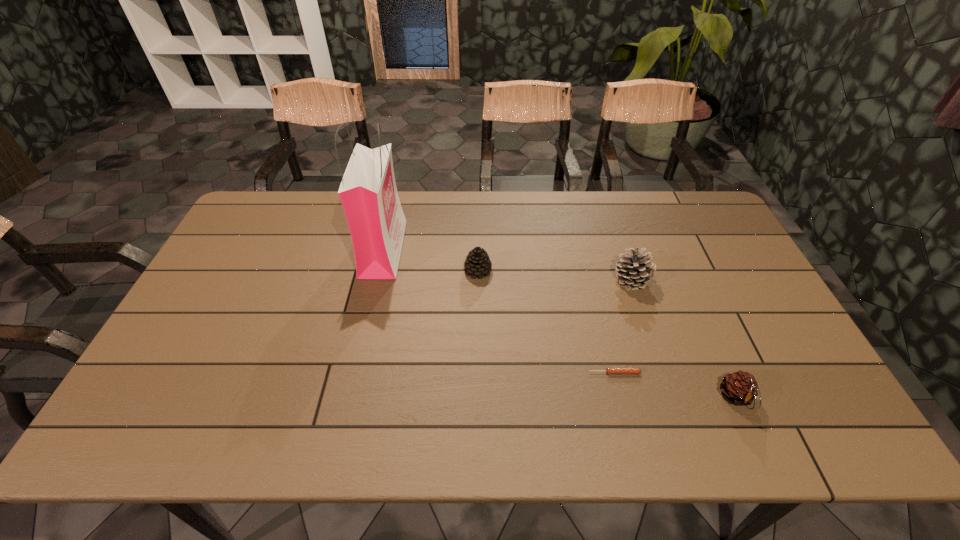
Image resolution: width=960 pixels, height=540 pixels. Identify the location of free space that satisfies the following two spatial constraints: 1. at the narrow end of the fourth farthest object; 2. on the right side of the leftmost pinecone. (477, 373).